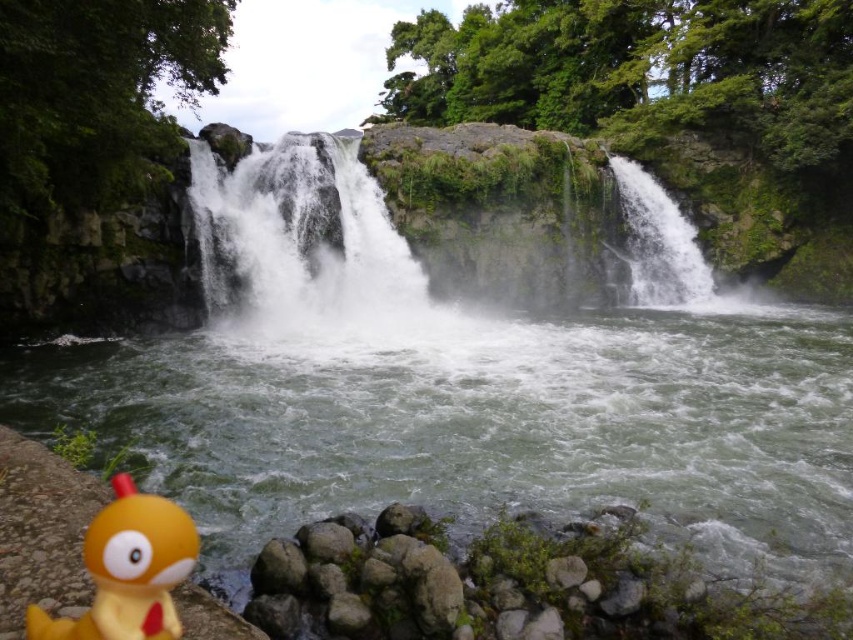
You are standing at the base of the waterfall and want to place a 2.5 meter long safety barrier between yourself and the white frothy water at center to protect visitors. Is the distance sufficient for the barrier to fit without overlapping the water or the visitor area?

The distance between the viewer and the white frothy water at center is 20.43 meters. Since the safety barrier is only 2.5 meters long, there is more than enough space to place it between the visitor area and the water without overlapping either.

You are a hiker who wants to take a photo of the white frothy water at center and the white frothy water at upper right. Which one will appear larger in your photo?

The white frothy water at center will appear larger in your photo because it is closer to you than the white frothy water at upper right.

You are a hiker who just found a yellow rubber duck at lower left on a stone ledge near a waterfall. You want to place it so it can float in the white frothy water at center. Is the duck currently positioned to the right or left of the water?

The yellow rubber duck at lower left is positioned to the right of the white frothy water at center, so placing it there would already be in a position to float in the water.